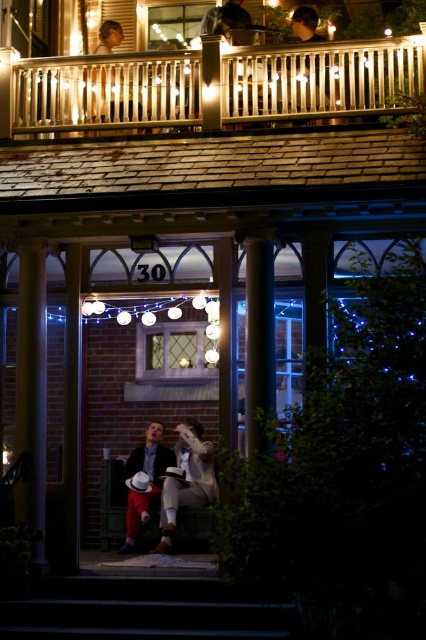
Question: Is metallic silver railing at upper center to the right of matte black hair at upper center from the viewer's perspective?

Choices:
 (A) yes
 (B) no

Answer: (A)

Question: Which point is closer to the camera taking this photo?

Choices:
 (A) (161, 531)
 (B) (238, 97)
 (C) (106, 32)
 (D) (154, 611)

Answer: (D)

Question: Among these objects, which one is farthest from the camera?

Choices:
 (A) metallic silver railing at upper center
 (B) white cotton shirt at center
 (C) matte black hair at upper center

Answer: (C)

Question: Does smooth concrete stairs at lower center appear on the left side of white cotton shirt at center?

Choices:
 (A) no
 (B) yes

Answer: (B)

Question: Can you confirm if metallic silver railing at upper center is wider than white cotton shirt at center?

Choices:
 (A) yes
 (B) no

Answer: (A)

Question: Which object is closer to the camera taking this photo?

Choices:
 (A) white cotton shirt at center
 (B) matte black hair at upper center
 (C) metallic silver railing at upper center

Answer: (C)